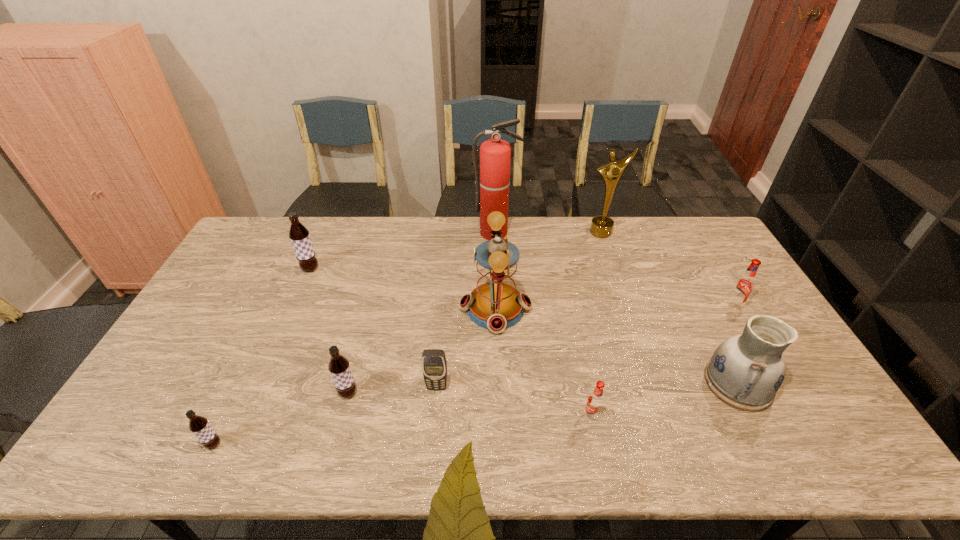
Identify the location of the third root beer from left to right. This screenshot has width=960, height=540. (339, 367).

Locate an element on the screen. the fourth object from left to right is located at coordinates (434, 365).

At what (x,y) coordinates should I click in order to perform the action: click on the nearest root beer. Please return your answer as a coordinate pair (x, y). The width and height of the screenshot is (960, 540). Looking at the image, I should click on (198, 425).

Identify the location of the nearest object. This screenshot has width=960, height=540. (198, 425).

The image size is (960, 540). In order to click on the fourth farthest root beer in this screenshot , I will do `click(595, 401)`.

Identify the location of the smaller red root beer. (595, 401).

Find the location of `free space located 0.350m with the nozzle and gauge on the tallest object`. free space located 0.350m with the nozzle and gauge on the tallest object is located at coordinates (498, 310).

Find the location of a particular element. This screenshot has width=960, height=540. vacant space located 0.380m on the front-facing side of the award is located at coordinates (629, 314).

Find the location of a particular element. This screenshot has height=540, width=960. vacant region located on the front-facing side of the eighth shortest object is located at coordinates (388, 308).

Identify the location of vacant position located on the front-facing side of the eighth shortest object. The width and height of the screenshot is (960, 540). (388, 308).